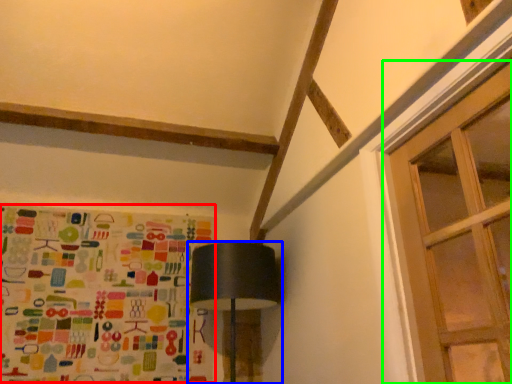
Question: Considering the real-world distances, which object is farthest from print (highlighted by a red box)? lamp (highlighted by a blue box) or window (highlighted by a green box)?

Choices:
 (A) lamp
 (B) window

Answer: (B)